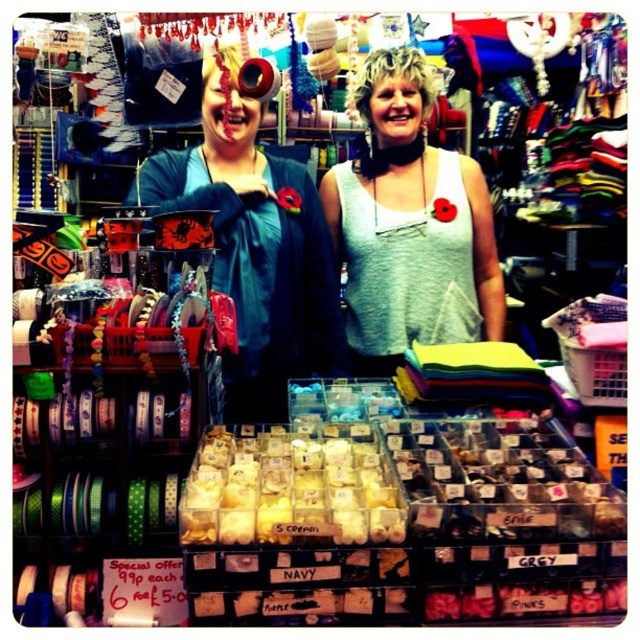
You are a customer in the craft store and want to place the blue fabric at center on top of the gray cotton tank top at center. The store requires that items must be at least 3 inches apart for display purposes. Can you do this without violating the store policy?

The distance between the blue fabric at center and the gray cotton tank top at center is 2.94 inches, which is less than the required 3 inches. Therefore, placing them this close would violate the store policy.

You are a customer in the craft shop and want to know which item is taller between the blue fabric at center and the gray cotton tank top at center. Can you tell me?

The blue fabric at center is taller than the gray cotton tank top at center.